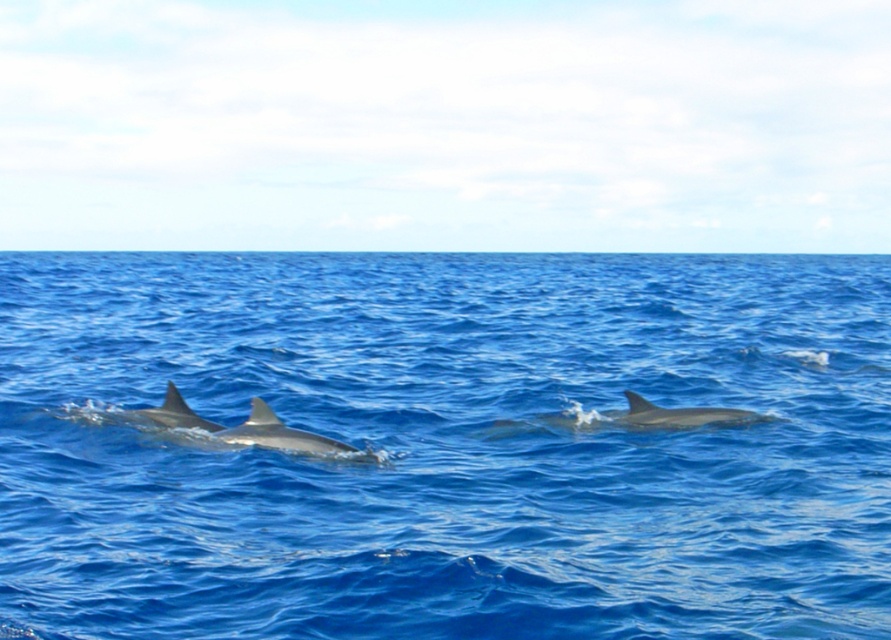
You are a photographer trying to capture a dolphin swimming in the ocean. You notice the blue smooth water at center and the glossy gray dolphin at center. Which object is located to the left of the other?

The blue smooth water at center is positioned on the left side of glossy gray dolphin at center, so the blue smooth water at center is to the left of the glossy gray dolphin at center.

You are a marine biologist observing dolphins in the ocean. You notice the blue smooth water at center and the gray smooth dolphin at center. Which object is located to the right of the other?

The blue smooth water at center is positioned on the right side of gray smooth dolphin at center, so the blue smooth water at center is to the right of the gray smooth dolphin at center.